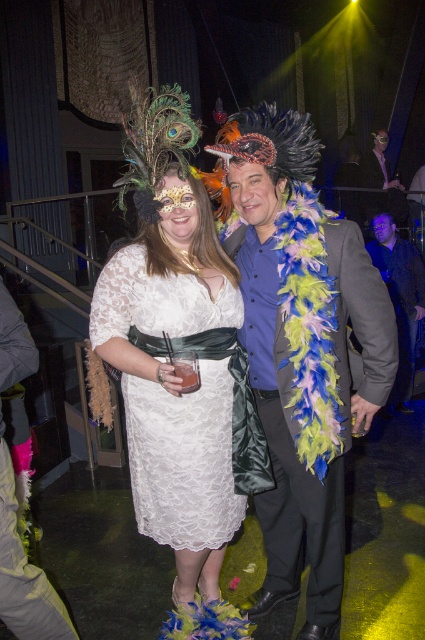
Question: Can you confirm if shiny blue feather boa at center is positioned below shiny black jacket at upper right?

Choices:
 (A) yes
 (B) no

Answer: (A)

Question: Can you confirm if shiny blue feather boa at center is wider than shiny black jacket at upper right?

Choices:
 (A) no
 (B) yes

Answer: (B)

Question: Which point is farther from the camera taking this photo?

Choices:
 (A) (130, 449)
 (B) (408, 305)

Answer: (B)

Question: Considering the real-world distances, which object is closest to the shiny blue feather boa at center?

Choices:
 (A) shiny black jacket at upper right
 (B) white lace dress at center
 (C) dark gray fabric jacket at right

Answer: (B)

Question: Does white lace dress at center come in front of dark gray fabric jacket at right?

Choices:
 (A) yes
 (B) no

Answer: (A)

Question: Which point appears closest to the camera in this image?

Choices:
 (A) (311, 515)
 (B) (206, 307)
 (C) (393, 408)
 (D) (360, 163)

Answer: (B)